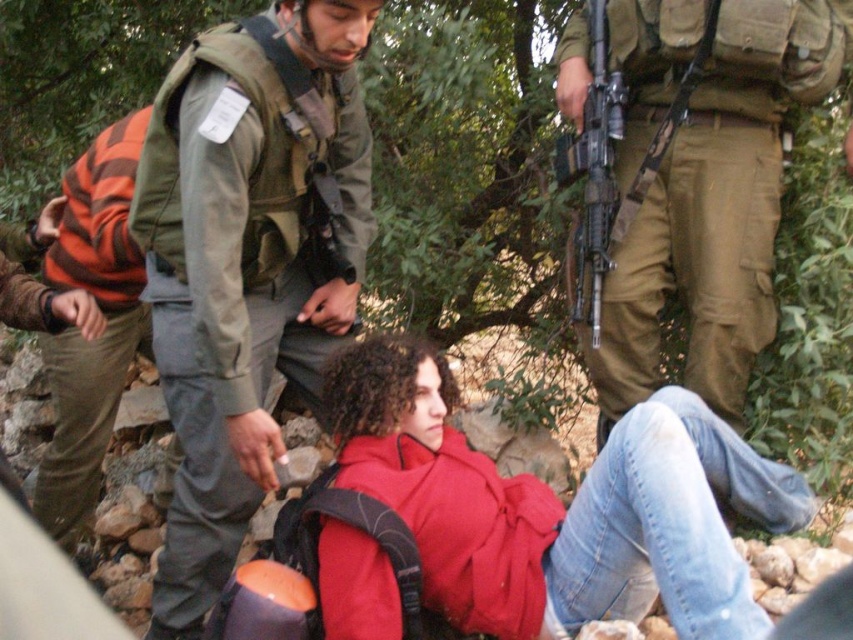
You are a drone operator trying to capture images of two specific points in the forest scene. The first point is at coordinates point [647,141] and the second is at point [85,182]. Which point should you focus on first if you want to ensure the closer one is captured clearly?

Point [647,141] is closer to the camera than point [85,182], so you should focus on point [647,141] first to ensure it is captured clearly.